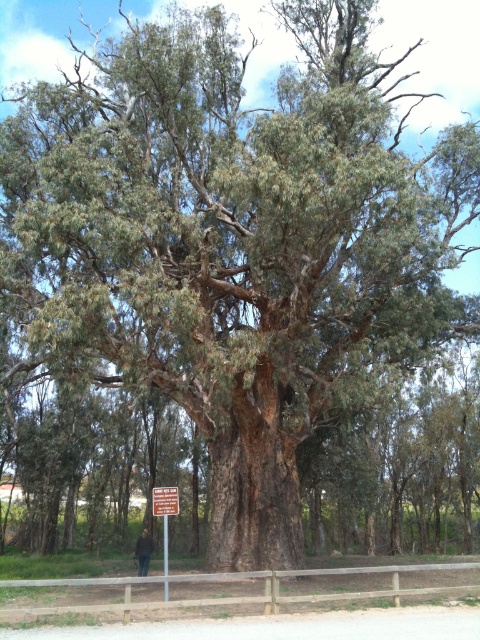
Question: Which point appears farthest from the camera in this image?

Choices:
 (A) (162, 508)
 (B) (168, 509)

Answer: (B)

Question: Can you confirm if brown wooden signpost at center is thinner than brown leather jacket at center?

Choices:
 (A) no
 (B) yes

Answer: (A)

Question: Does red plastic sign at center lie in front of brown leather jacket at center?

Choices:
 (A) no
 (B) yes

Answer: (B)

Question: Which point is closer to the camera?

Choices:
 (A) (170, 512)
 (B) (136, 540)
 (C) (158, 515)

Answer: (A)

Question: Is brown wooden signpost at center smaller than red plastic sign at center?

Choices:
 (A) yes
 (B) no

Answer: (B)

Question: Based on their relative distances, which object is nearer to the brown wooden signpost at center?

Choices:
 (A) red plastic sign at center
 (B) brown leather jacket at center

Answer: (A)